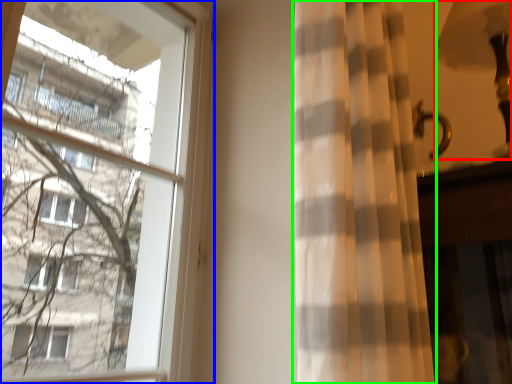
Question: Which object is positioned closest to table lamp (highlighted by a red box)? Select from window (highlighted by a blue box) and curtain (highlighted by a green box).

Choices:
 (A) window
 (B) curtain

Answer: (B)